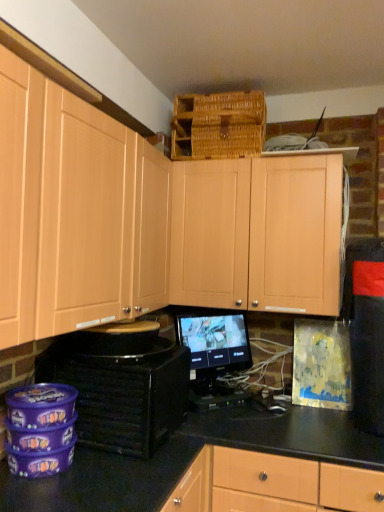
Question: Considering the positions of point (221, 108) and point (39, 95), is point (221, 108) closer or farther from the camera than point (39, 95)?

Choices:
 (A) farther
 (B) closer

Answer: (A)

Question: Is woven brown basket at upper center to the left or to the right of matte wood cabinets at upper center, the second cabinetry in the right-to-left sequence, in the image?

Choices:
 (A) right
 (B) left

Answer: (A)

Question: Estimate the real-world distances between objects in this image. Which object is closer to the matte wood cabinets at upper center, the second cabinetry in the right-to-left sequence?

Choices:
 (A) black matte speaker at lower left
 (B) black glossy monitor at center
 (C) light wood cabinet at upper center, the first cabinetry from the right
 (D) black glossy counter top at center
 (E) woven brown basket at upper center

Answer: (A)

Question: Which object is positioned closest to the black matte speaker at lower left?

Choices:
 (A) light wood cabinet at upper center, the first cabinetry from the right
 (B) matte wood cabinets at upper center, which ranks as the 1th cabinetry in left-to-right order
 (C) black glossy monitor at center
 (D) woven brown basket at upper center
 (E) black glossy counter top at center

Answer: (B)